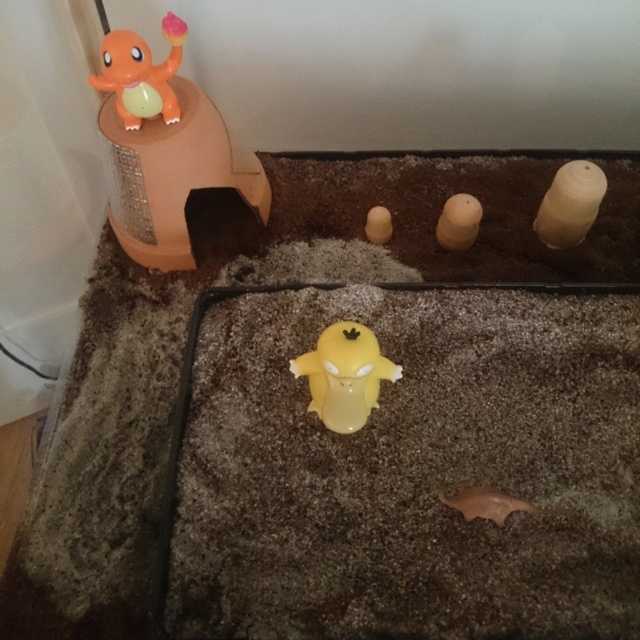
Question: Which of the following is the closest to the observer?

Choices:
 (A) (180, 60)
 (B) (356, 417)

Answer: (B)

Question: Based on their relative distances, which object is nearer to the matte brown egg at center?

Choices:
 (A) matte orange plastic charmander at upper left
 (B) yellow matte/yellowish plastic at center

Answer: (B)

Question: In this image, where is orange matte plastic toy at upper left located relative to matte orange plastic charmander at upper left?

Choices:
 (A) right
 (B) left

Answer: (A)

Question: Which of the following is the farthest from the observer?

Choices:
 (A) (x=124, y=45)
 (B) (x=355, y=403)
 (C) (x=195, y=161)
 (D) (x=372, y=237)

Answer: (D)

Question: Is orange matte plastic toy at upper left further to the viewer compared to yellow matte/yellowish plastic at center?

Choices:
 (A) yes
 (B) no

Answer: (A)

Question: Does orange matte plastic toy at upper left lie in front of matte orange plastic charmander at upper left?

Choices:
 (A) yes
 (B) no

Answer: (A)